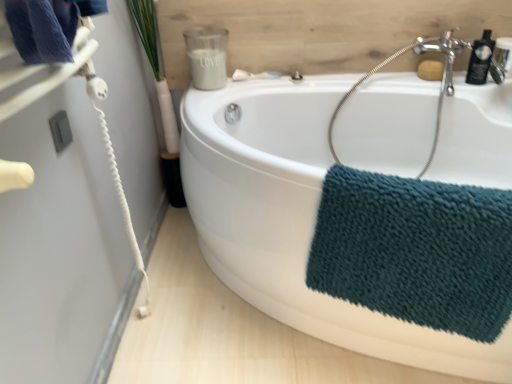
Locate an element on the screen. The image size is (512, 384). vacant region under green leafy plant at upper left (from a real-world perspective) is located at coordinates (178, 215).